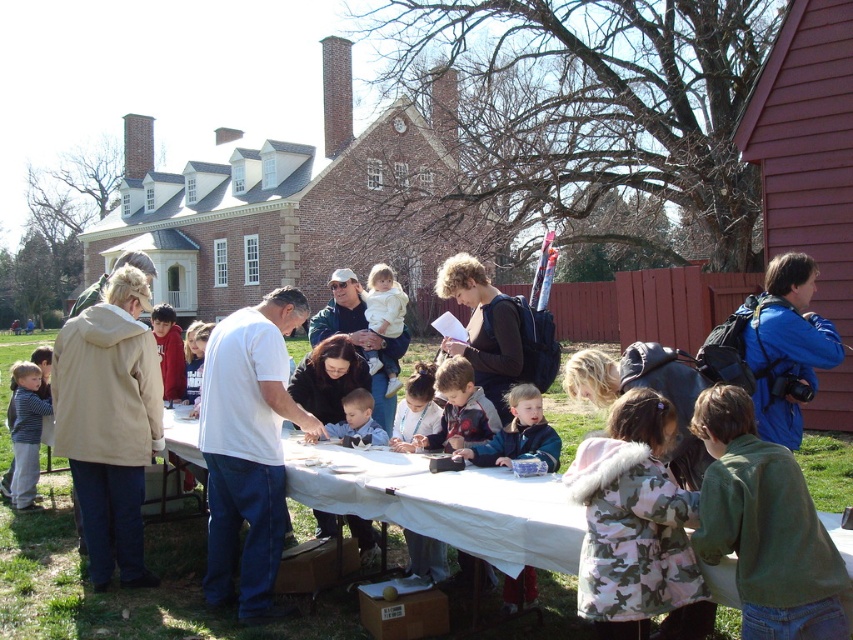
Looking at this image, can you confirm if white matte shirt at center is thinner than white cotton shirt at center?

Correct, white matte shirt at center's width is less than white cotton shirt at center's.

Which of these two, white matte shirt at center or white cotton shirt at center, stands shorter?

With less height is white matte shirt at center.

Who is more distant from viewer, (216, 516) or (398, 317)?

Positioned behind is point (398, 317).

Where is `white matte shirt at center`? The height and width of the screenshot is (640, 853). white matte shirt at center is located at coordinates (248, 449).

Does beige fleece jacket at left have a greater height compared to striped shirt at lower left?

Correct, beige fleece jacket at left is much taller as striped shirt at lower left.

Who is more distant from viewer, (105, 488) or (35, 474)?

Positioned behind is point (35, 474).

Which is in front, point (94, 472) or point (27, 362)?

Positioned in front is point (94, 472).

Find the location of a particular element. This screenshot has height=640, width=853. beige fleece jacket at left is located at coordinates pyautogui.click(x=109, y=422).

From the picture: Is camo coat at lower right shorter than white cotton shirt at center?

Yes.

Which of these two, camo coat at lower right or white cotton shirt at center, stands shorter?

Standing shorter between the two is camo coat at lower right.

Which is in front, point (601, 444) or point (386, 321)?

Positioned in front is point (601, 444).

Identify the location of camo coat at lower right. The height and width of the screenshot is (640, 853). (633, 522).